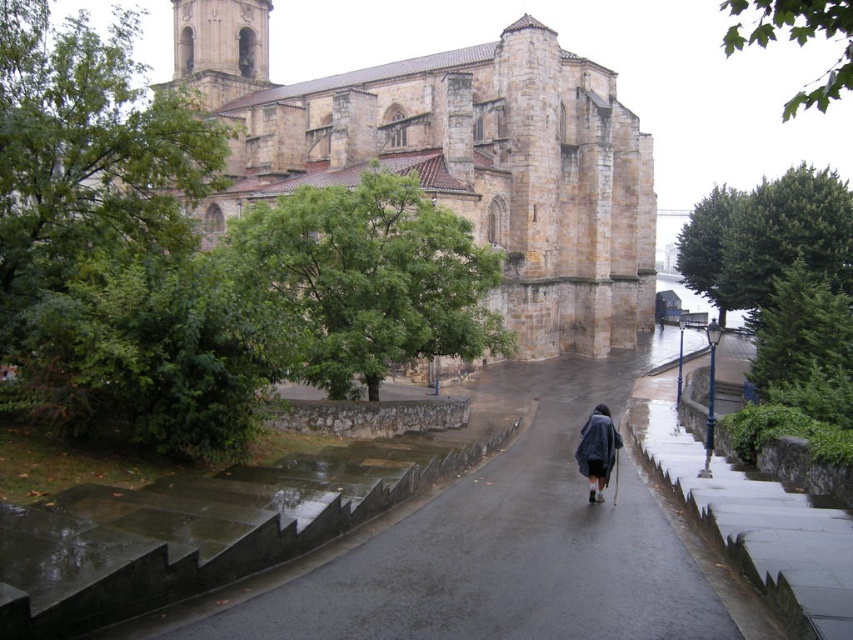
From the picture: Does smooth asphalt road at center appear over dark blue fabric coat at center?

No, smooth asphalt road at center is not above dark blue fabric coat at center.

Is the position of smooth asphalt road at center less distant than that of dark blue fabric coat at center?

Yes, it is in front of dark blue fabric coat at center.

Is point (523, 621) farther from camera compared to point (584, 470)?

No.

Find the location of `smooth asphalt road at center`. smooth asphalt road at center is located at coordinates (503, 547).

Does brown stone church at upper center come behind dark blue fabric coat at center?

Yes, brown stone church at upper center is behind dark blue fabric coat at center.

Between point (566, 100) and point (579, 444), which one is positioned behind?

The point (566, 100) is behind.

I want to click on brown stone church at upper center, so click(x=456, y=157).

How much distance is there between brown stone church at upper center and smooth asphalt road at center?

59.83 meters

Is brown stone church at upper center positioned in front of smooth asphalt road at center?

No, it is not.

At what (x,y) coordinates should I click in order to perform the action: click on brown stone church at upper center. Please return your answer as a coordinate pair (x, y). This screenshot has width=853, height=640. Looking at the image, I should click on (456, 157).